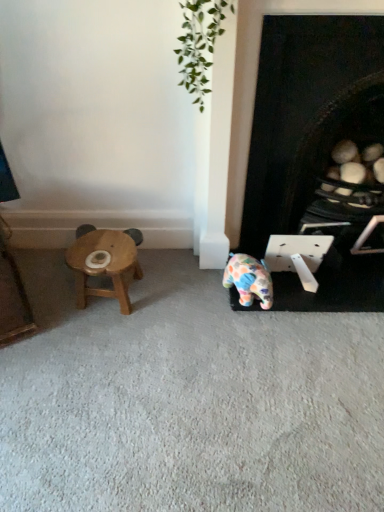
Question: Should I look upward or downward to see wooden stool at left?

Choices:
 (A) up
 (B) down

Answer: (B)

Question: Could you tell me if wooden stool at left is facing black matte fireplace at lower right?

Choices:
 (A) yes
 (B) no

Answer: (B)

Question: Is wooden stool at left behind black matte fireplace at lower right?

Choices:
 (A) no
 (B) yes

Answer: (B)

Question: Is wooden stool at left smaller than black matte fireplace at lower right?

Choices:
 (A) no
 (B) yes

Answer: (B)

Question: Can you confirm if wooden stool at left is bigger than black matte fireplace at lower right?

Choices:
 (A) yes
 (B) no

Answer: (B)

Question: From the image's perspective, is wooden stool at left located above black matte fireplace at lower right?

Choices:
 (A) yes
 (B) no

Answer: (B)

Question: Considering the relative sizes of wooden stool at left and black matte fireplace at lower right in the image provided, is wooden stool at left thinner than black matte fireplace at lower right?

Choices:
 (A) no
 (B) yes

Answer: (B)

Question: Can you confirm if polka dot ceramic elephant at center is bigger than black matte fireplace at lower right?

Choices:
 (A) yes
 (B) no

Answer: (B)

Question: From the image's perspective, is polka dot ceramic elephant at center located above black matte fireplace at lower right?

Choices:
 (A) no
 (B) yes

Answer: (A)

Question: Considering the relative sizes of polka dot ceramic elephant at center and black matte fireplace at lower right in the image provided, is polka dot ceramic elephant at center thinner than black matte fireplace at lower right?

Choices:
 (A) no
 (B) yes

Answer: (B)

Question: Can you confirm if polka dot ceramic elephant at center is positioned to the right of black matte fireplace at lower right?

Choices:
 (A) yes
 (B) no

Answer: (B)

Question: Is black matte fireplace at lower right completely or partially inside polka dot ceramic elephant at center?

Choices:
 (A) no
 (B) yes

Answer: (A)

Question: From a real-world perspective, is polka dot ceramic elephant at center on black matte fireplace at lower right?

Choices:
 (A) yes
 (B) no

Answer: (B)

Question: Is there a large distance between black matte fireplace at lower right and wooden stool at left?

Choices:
 (A) yes
 (B) no

Answer: (B)